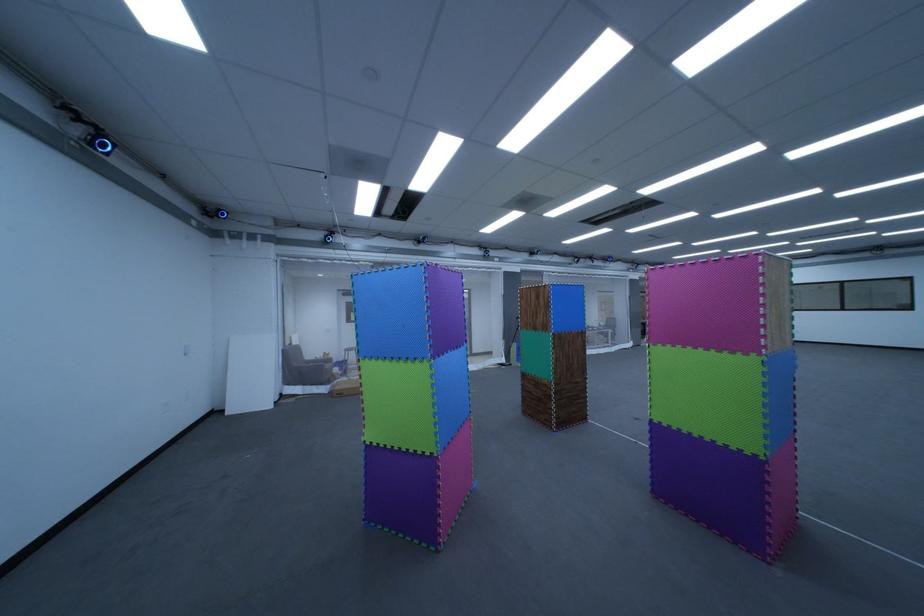
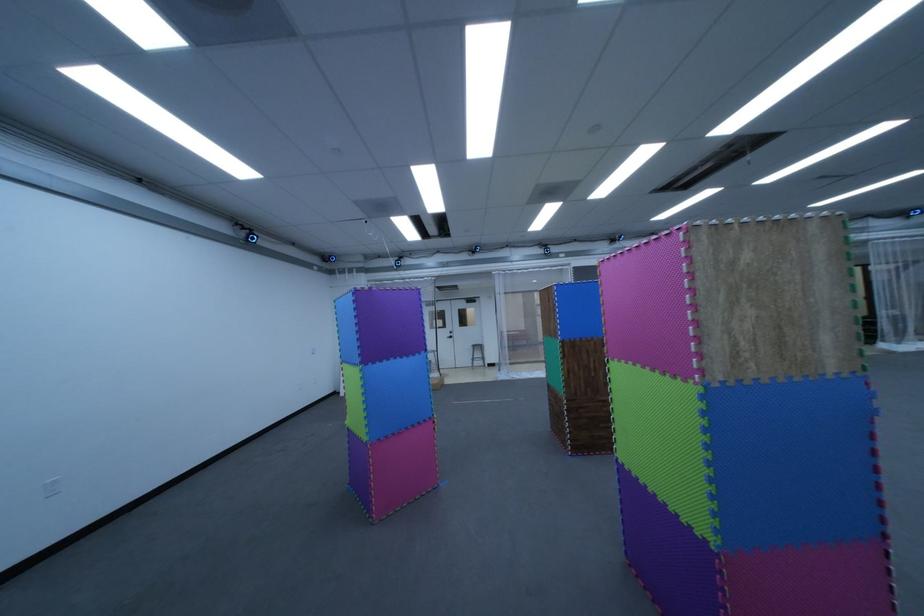
Question: The images are taken continuously from a first-person perspective. In which direction are you moving?

Choices:
 (A) Left
 (B) Right
 (C) Forward
 (D) Backward

Answer: (B)